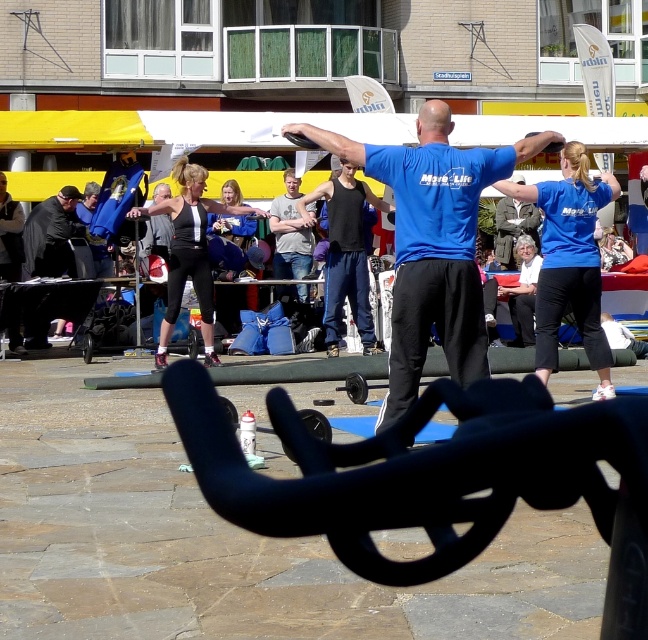
Question: Based on their relative distances, which object is nearer to the black matte leggings at center?

Choices:
 (A) blue cotton shirt at center
 (B) dark gray fabric jacket at left
 (C) black matte tank top at center
 (D) gray cotton shirt at center

Answer: (C)

Question: Can you confirm if black matte tank top at center is smaller than dark gray fabric jacket at left?

Choices:
 (A) yes
 (B) no

Answer: (B)

Question: Considering the relative positions of black matte leggings at center and dark gray fabric jacket at left in the image provided, where is black matte leggings at center located with respect to dark gray fabric jacket at left?

Choices:
 (A) above
 (B) below

Answer: (B)

Question: Among these objects, which one is farthest from the camera?

Choices:
 (A) matte blue shirt at center
 (B) khaki cotton jacket at center
 (C) dark gray fabric jacket at left
 (D) black matte leggings at center

Answer: (B)

Question: Estimate the real-world distances between objects in this image. Which object is farther from the black matte leggings at center?

Choices:
 (A) dark gray fabric jacket at left
 (B) khaki cotton jacket at center
 (C) blue cotton shirt at center
 (D) matte blue shirt at center

Answer: (B)

Question: Can you confirm if matte blue shirt at center is thinner than black matte tank top at center?

Choices:
 (A) yes
 (B) no

Answer: (B)